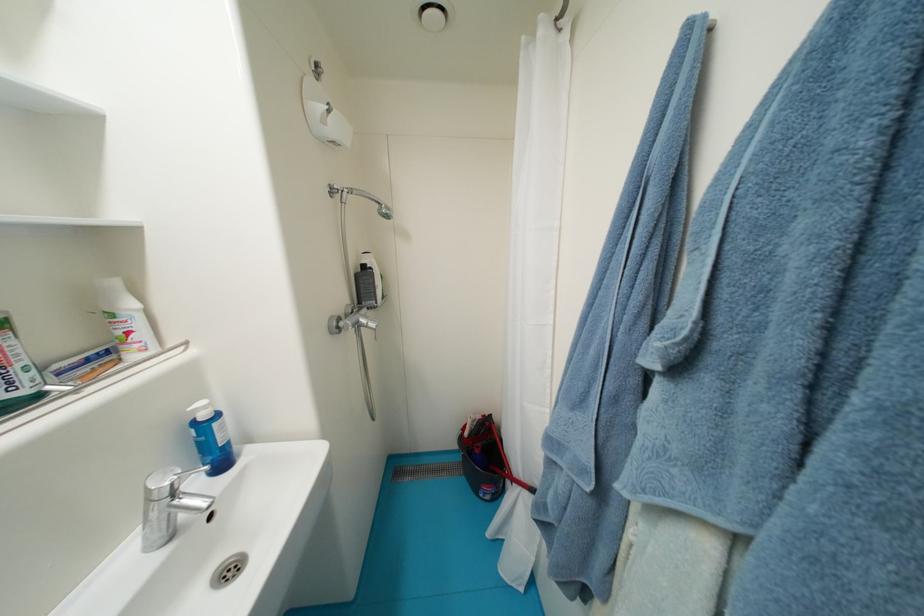
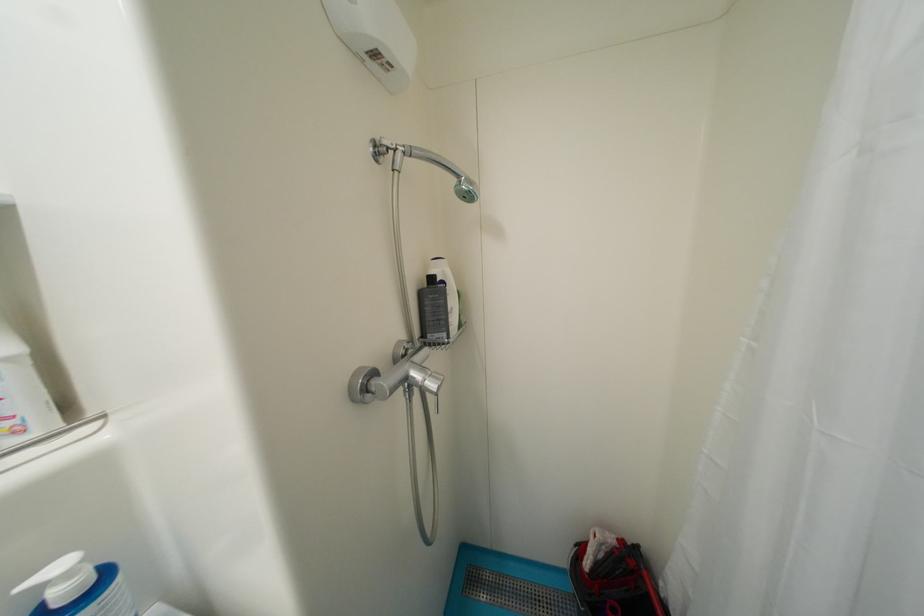
The point at (394, 217) is marked in the first image. Where is the corresponding point in the second image?

(476, 199)